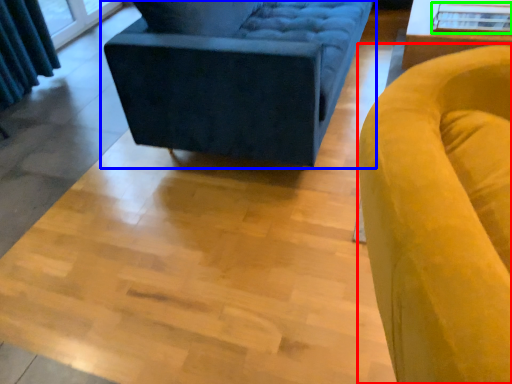
Question: Considering the real-world distances, which object is closest to chair (highlighted by a red box)? studio couch (highlighted by a blue box) or glass table (highlighted by a green box).

Choices:
 (A) studio couch
 (B) glass table

Answer: (A)